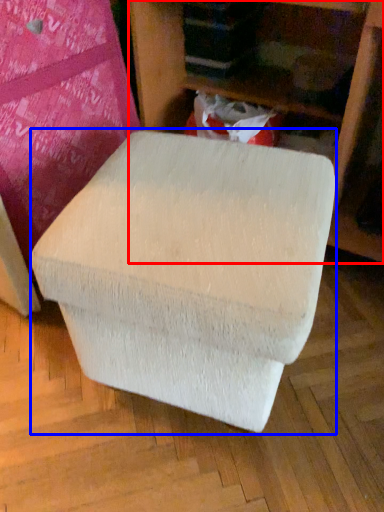
Question: Among these objects, which one is nearest to the camera, furniture (highlighted by a red box) or bean bag chair (highlighted by a blue box)?

Choices:
 (A) furniture
 (B) bean bag chair

Answer: (B)